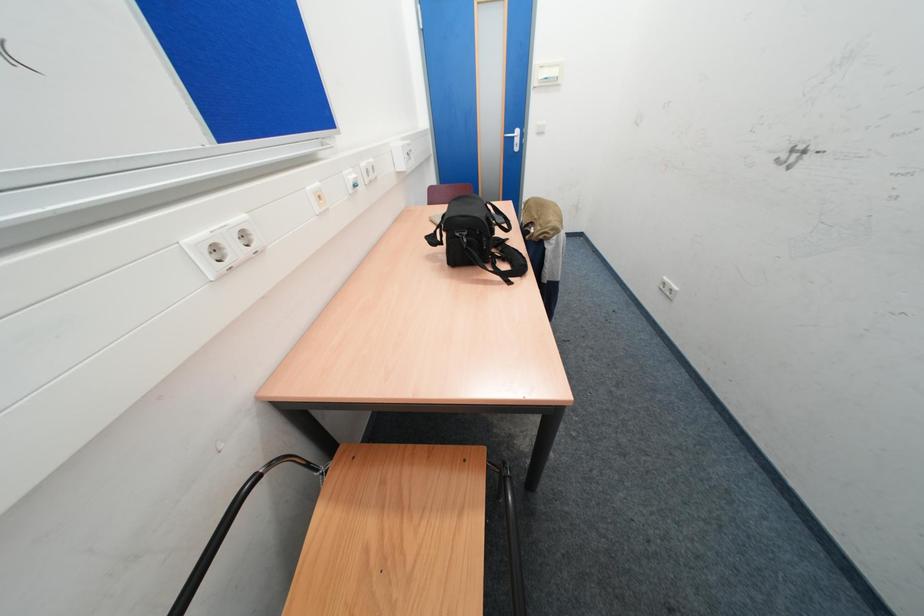
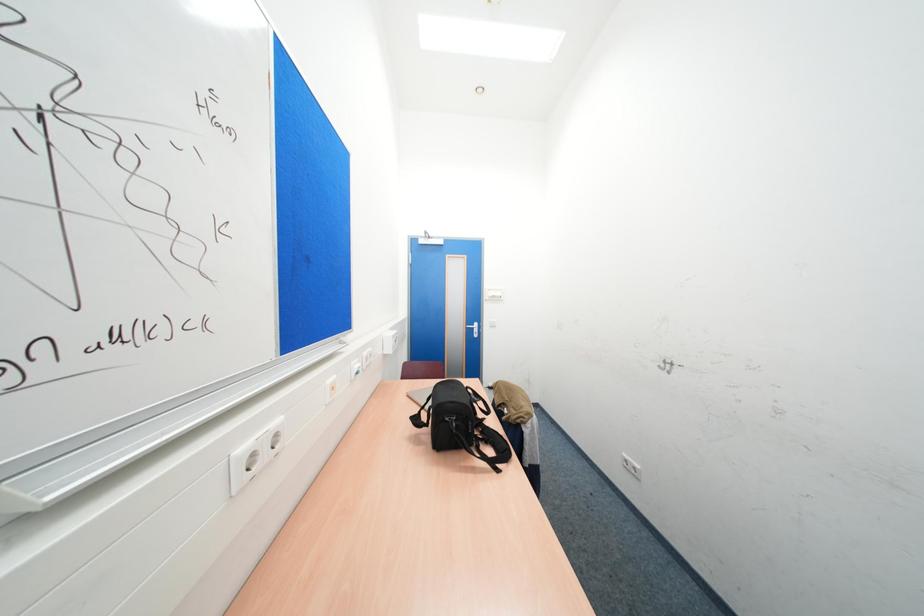
Question: How did the camera likely rotate?

Choices:
 (A) Left
 (B) Right
 (C) Up
 (D) Down

Answer: (C)